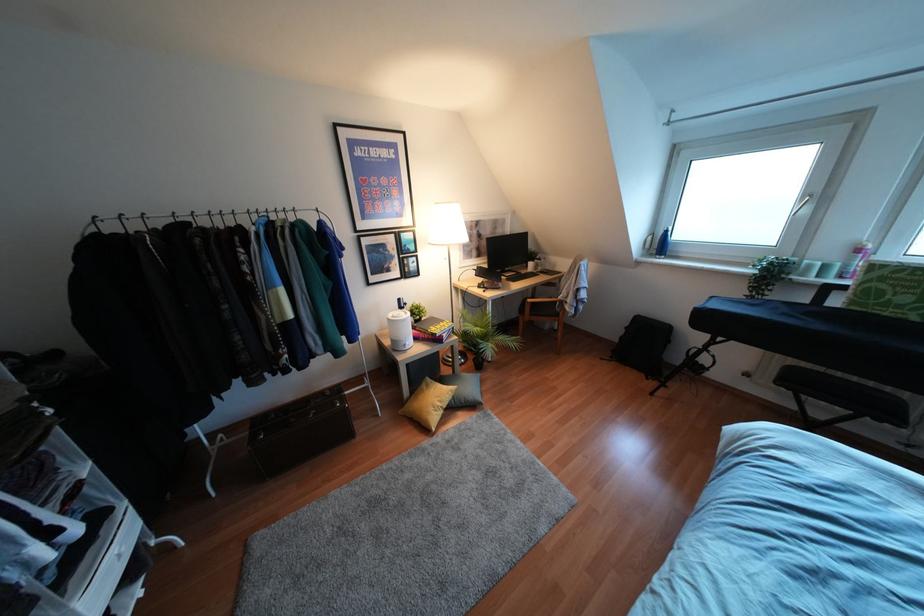
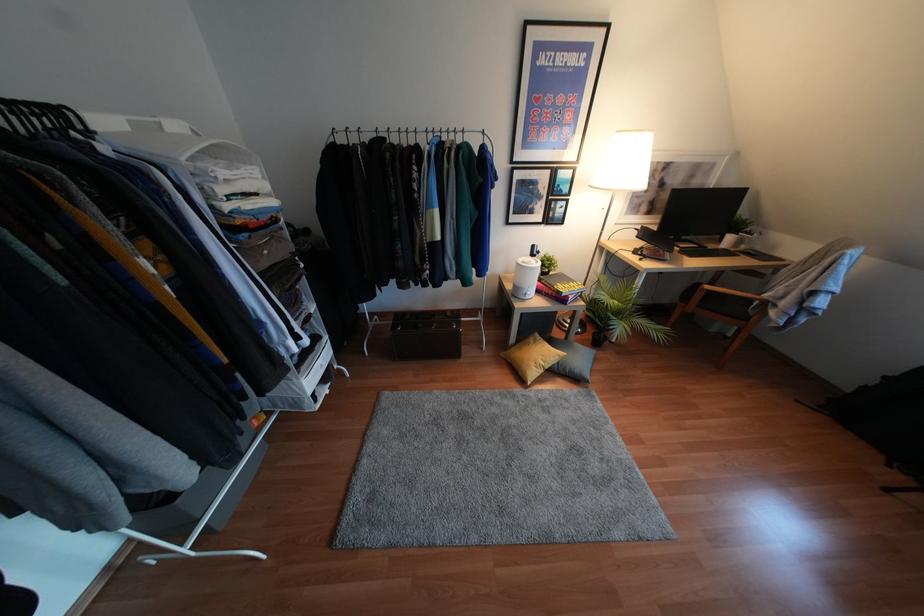
Where in the second image is the point corresponding to (482,359) from the first image?

(604, 336)